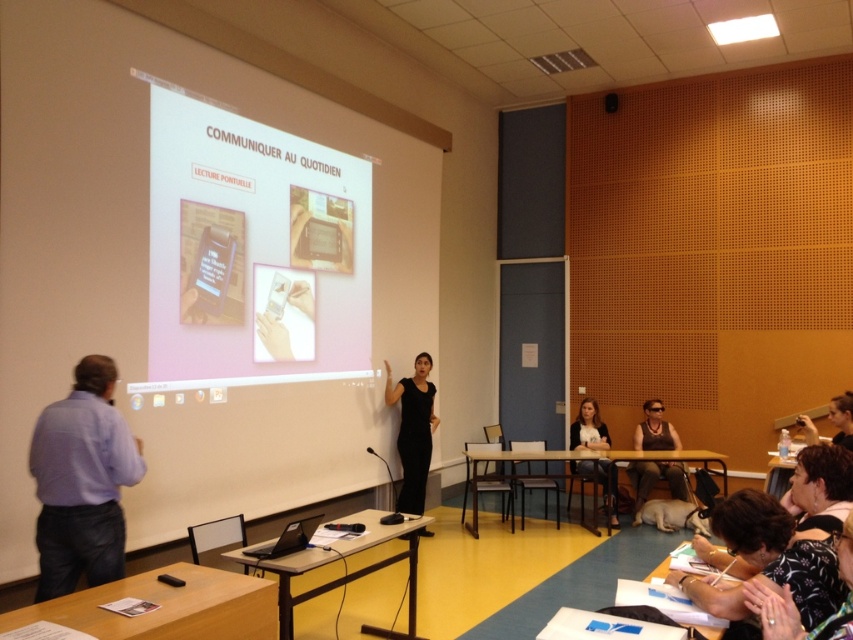
Question: Among these objects, which one is nearest to the camera?

Choices:
 (A) black fabric shirt at center
 (B) purple shirt at left

Answer: (B)

Question: Does smooth black hair at upper center have a greater width compared to matte black tank top at lower right?

Choices:
 (A) no
 (B) yes

Answer: (A)

Question: Among these objects, which one is nearest to the camera?

Choices:
 (A) dark brown leather jacket at lower right
 (B) matte black tank top at lower right
 (C) purple shirt at left
 (D) floral-patterned blouse at lower right

Answer: (D)

Question: Does floral-patterned blouse at lower right come in front of matte black tank top at lower right?

Choices:
 (A) yes
 (B) no

Answer: (A)

Question: Can you confirm if black matte dress at center is positioned to the right of black fabric shirt at center?

Choices:
 (A) yes
 (B) no

Answer: (B)

Question: Which point is farther from the camera taking this photo?

Choices:
 (A) (428, 355)
 (B) (653, 467)
 (C) (601, 474)
 (D) (813, 545)

Answer: (C)